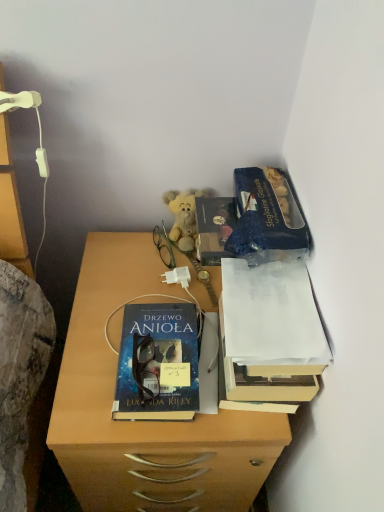
Question: Considering the relative sizes of matte wooden desk at center and green plastic glasses at center in the image provided, is matte wooden desk at center shorter than green plastic glasses at center?

Choices:
 (A) yes
 (B) no

Answer: (B)

Question: Considering the relative sizes of matte wooden desk at center and green plastic glasses at center in the image provided, is matte wooden desk at center wider than green plastic glasses at center?

Choices:
 (A) yes
 (B) no

Answer: (A)

Question: Considering the relative positions of matte wooden desk at center and green plastic glasses at center in the image provided, is matte wooden desk at center to the left of green plastic glasses at center from the viewer's perspective?

Choices:
 (A) yes
 (B) no

Answer: (B)

Question: Considering the relative sizes of matte wooden desk at center and green plastic glasses at center in the image provided, is matte wooden desk at center bigger than green plastic glasses at center?

Choices:
 (A) yes
 (B) no

Answer: (A)

Question: Is matte wooden desk at center oriented away from green plastic glasses at center?

Choices:
 (A) no
 (B) yes

Answer: (A)

Question: In the image, is blue matte paper at upper right on the left side or the right side of green plastic glasses at center?

Choices:
 (A) right
 (B) left

Answer: (A)

Question: Considering the positions of blue matte paper at upper right and green plastic glasses at center in the image, is blue matte paper at upper right wider or thinner than green plastic glasses at center?

Choices:
 (A) thin
 (B) wide

Answer: (B)

Question: In terms of height, does blue matte paper at upper right look taller or shorter compared to green plastic glasses at center?

Choices:
 (A) short
 (B) tall

Answer: (B)

Question: Is point (243, 214) closer or farther from the camera than point (157, 229)?

Choices:
 (A) farther
 (B) closer

Answer: (B)

Question: Considering the positions of matte wooden desk at center and white paper at upper right, acting as the 2th book starting from the left, in the image, is matte wooden desk at center bigger or smaller than white paper at upper right, acting as the 2th book starting from the left,?

Choices:
 (A) small
 (B) big

Answer: (B)

Question: Is matte wooden desk at center to the left or to the right of white paper at upper right, which ranks as the 1th book in right-to-left order, in the image?

Choices:
 (A) left
 (B) right

Answer: (A)

Question: From the image's perspective, is matte wooden desk at center above or below white paper at upper right, which ranks as the 1th book in right-to-left order?

Choices:
 (A) above
 (B) below

Answer: (B)

Question: From a real-world perspective, is matte wooden desk at center above or below white paper at upper right, acting as the 2th book starting from the left?

Choices:
 (A) below
 (B) above

Answer: (A)

Question: Is soft yellow plush at center wider or thinner than white paper at upper right, acting as the 2th book starting from the left?

Choices:
 (A) thin
 (B) wide

Answer: (A)

Question: Relative to white paper at upper right, acting as the 2th book starting from the left, is soft yellow plush at center in front or behind?

Choices:
 (A) behind
 (B) front

Answer: (A)